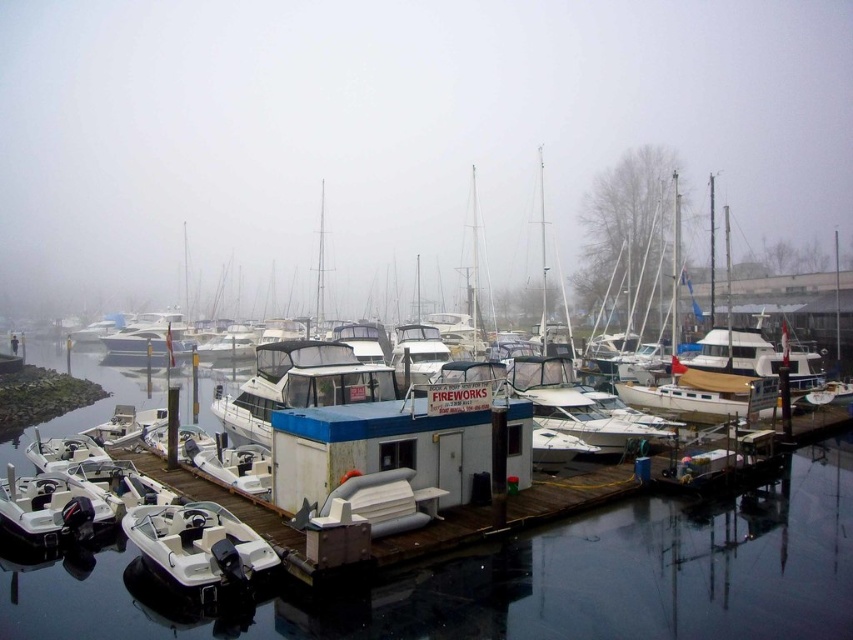
You are a photographer planning to capture the marina scene. You want to ensure that both the transparent water at center and the white rubber boat at lower left are clearly visible in your shot. Considering their sizes, which object should you focus on first to ensure it fits within the frame?

The transparent water at center is bigger than the white rubber boat at lower left, so you should focus on capturing the transparent water at center first to ensure it fits within the frame, as it requires more space.

You are a photographer trying to capture the white rubber boat at lower left and the transparent water at center in the same frame. Based on their heights, which object will appear closer to the top of your photo?

The white rubber boat at lower left will appear closer to the top of the photo because it is taller than the transparent water at center.

You are a visitor at the marina and want to take a photo of the white matte houseboat at center. Since the transparent water at center is directly below it, will the houseboat be reflected in the water?

The transparent water at center is positioned under white matte houseboat at center, so yes, the white matte houseboat at center will be reflected in the transparent water at center.